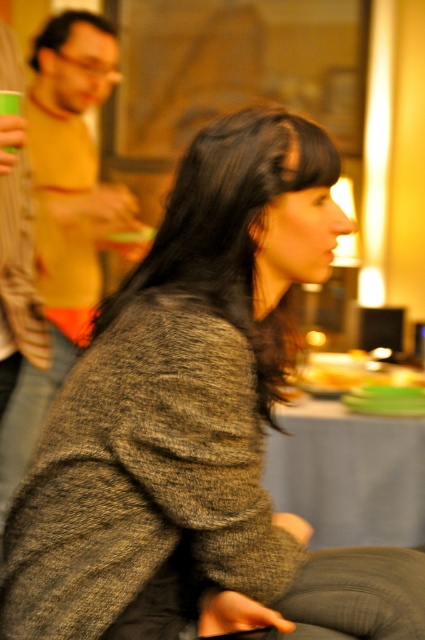
Question: Is matte yellow shirt at left wider than blue fabric table at center?

Choices:
 (A) yes
 (B) no

Answer: (B)

Question: Which of these objects is positioned closest to the blue fabric table at center?

Choices:
 (A) matte yellow shirt at left
 (B) matte plastic cup at upper left

Answer: (A)

Question: Is blue fabric table at center smaller than matte plastic cup at upper left?

Choices:
 (A) yes
 (B) no

Answer: (B)

Question: Which of the following is the closest to the observer?

Choices:
 (A) matte yellow shirt at left
 (B) blue fabric table at center
 (C) matte plastic cup at upper left

Answer: (C)

Question: Among these objects, which one is farthest from the camera?

Choices:
 (A) matte yellow shirt at left
 (B) blue fabric table at center

Answer: (B)

Question: Does blue fabric table at center have a lesser width compared to matte plastic cup at upper left?

Choices:
 (A) no
 (B) yes

Answer: (A)